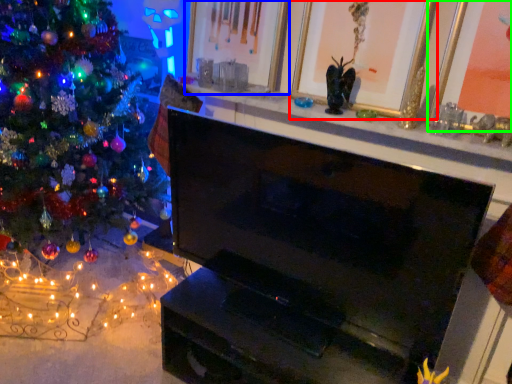
Question: Which object is the farthest from picture frame (highlighted by a red box)? Choose among these: picture frame (highlighted by a blue box) or picture frame (highlighted by a green box).

Choices:
 (A) picture frame
 (B) picture frame

Answer: (B)